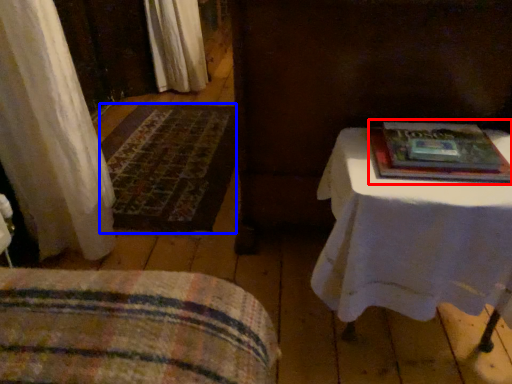
Question: Among these objects, which one is farthest to the camera, paperback book (highlighted by a red box) or mat (highlighted by a blue box)?

Choices:
 (A) paperback book
 (B) mat

Answer: (B)